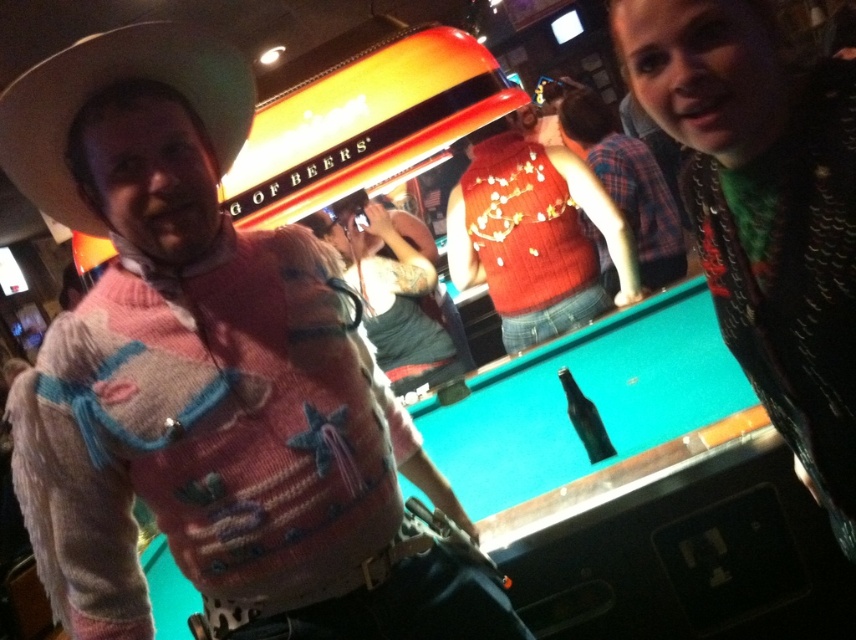
Question: Can you confirm if knitted sweater at upper right is positioned above green glass bottle at center?

Choices:
 (A) no
 (B) yes

Answer: (B)

Question: Which object appears closest to the camera in this image?

Choices:
 (A) knitted red sweater at center
 (B) knitted sweater at upper right
 (C) white felt cowboy hat at upper left
 (D) green glass bottle at center

Answer: (C)

Question: Considering the real-world distances, which object is closest to the pink knitted sweater at left?

Choices:
 (A) green glass bottle at center
 (B) teal felt pool table at center
 (C) knitted red sweater at center

Answer: (A)

Question: Can you confirm if teal felt pool table at center is bigger than knitted red sweater at center?

Choices:
 (A) no
 (B) yes

Answer: (B)

Question: Which point is farther to the camera?

Choices:
 (A) (591, 412)
 (B) (693, 348)

Answer: (B)

Question: Is the position of pink knitted sweater at left more distant than that of white felt cowboy hat at upper left?

Choices:
 (A) no
 (B) yes

Answer: (B)